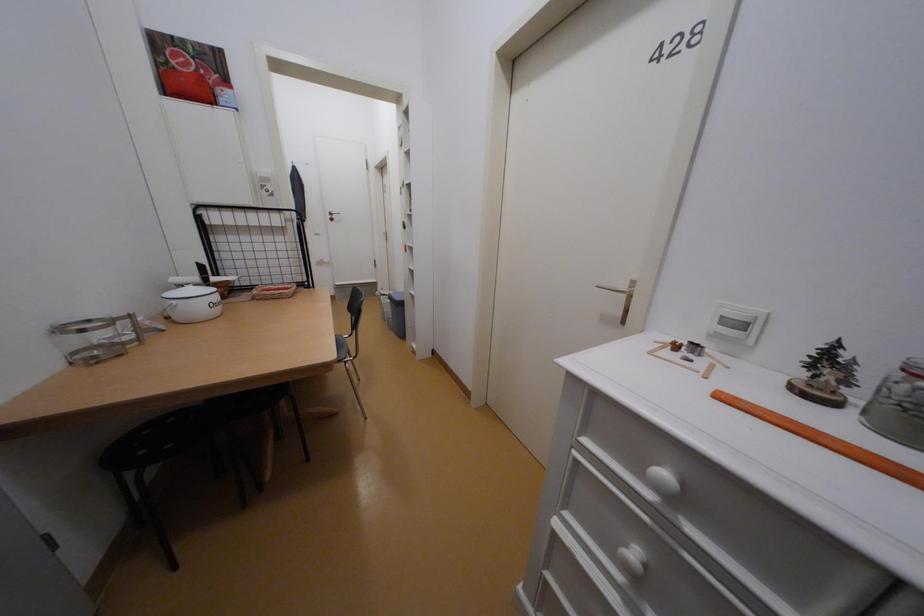
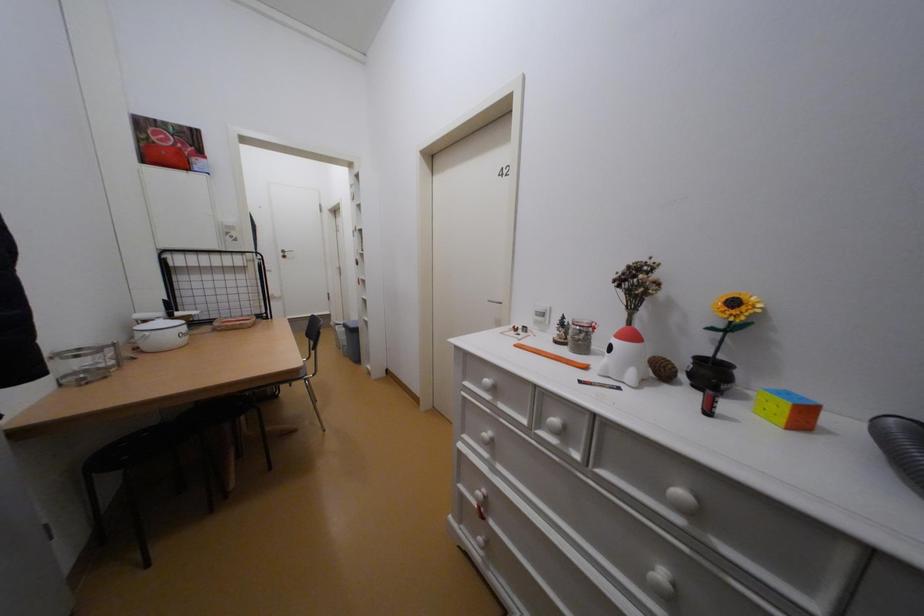
Question: Based on the continuous images, in which direction is the camera rotating? Reply with the corresponding letter.

Choices:
 (A) Left
 (B) Right
 (C) Up
 (D) Down

Answer: (B)